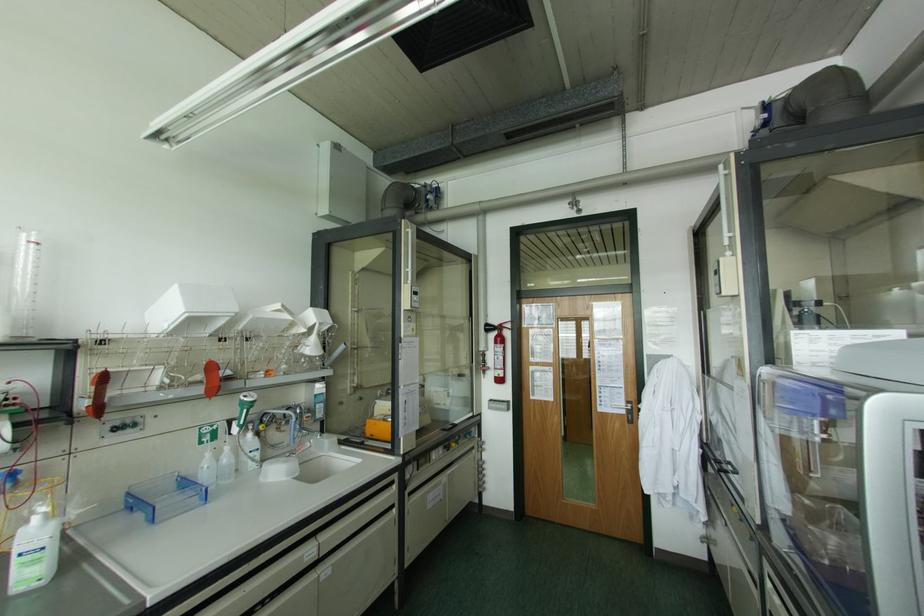
Where would you push the white pump dispenser? Please return your answer as a coordinate pair (x, y).

(34, 551)